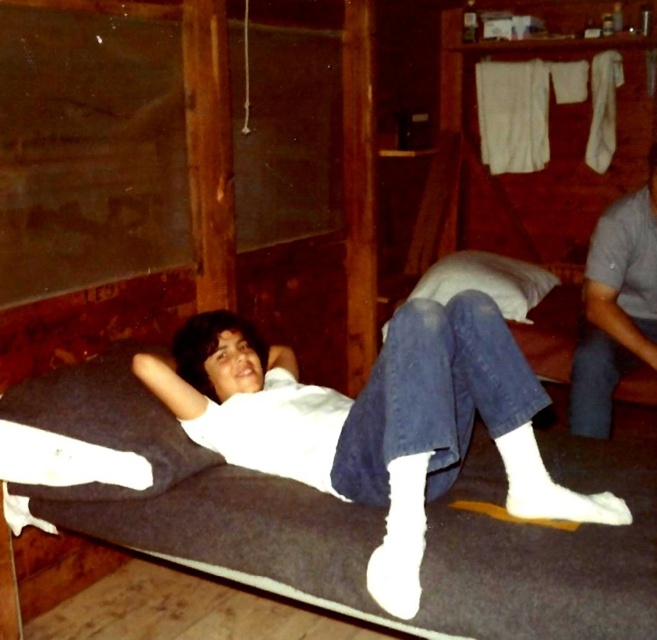
The scene shows a person lying on a mattress in a rustic room. There is a point at coordinates [374,420]. What object is located at that point?

The point at coordinates [374,420] is occupied by the white matte shirt at center.

You are a photographer setting up a shoot in this cabin. You need to position a light source to the right of the white matte shirt at center. Where should you place the light relative to the shirt?

The white matte shirt at center is located at point (374, 420), so you should place the light to the right of this coordinate to ensure proper illumination.

You are a photographer trying to capture the person in the image. Since both the white matte shirt at center and the white soft pillow at center are white, how can you ensure the camera focuses on the person instead of the pillow?

The white matte shirt at center is in front of the white soft pillow at center, so focusing on the shirt will naturally draw attention to the person rather than the pillow behind them.